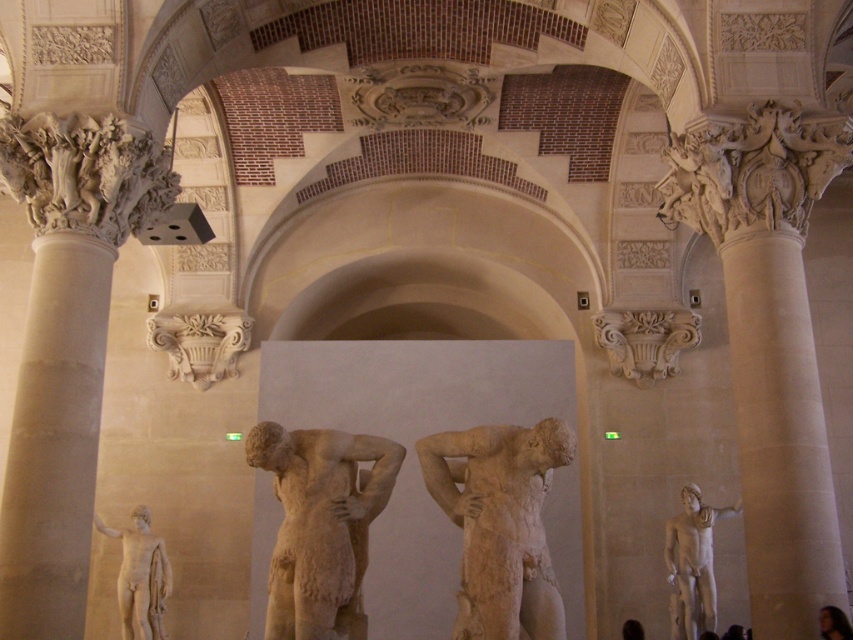
Question: Which of the following is the closest to the observer?

Choices:
 (A) (683, 628)
 (B) (741, 188)
 (C) (114, 259)

Answer: (B)

Question: Can you confirm if carved stone ornament at upper right is positioned to the left of blonde hair at lower right?

Choices:
 (A) yes
 (B) no

Answer: (B)

Question: Which of the following is the farthest from the observer?

Choices:
 (A) white marble statue at right
 (B) white marble column at left

Answer: (A)

Question: Can you confirm if white marble column at right is positioned to the left of matte white statue at lower left?

Choices:
 (A) no
 (B) yes

Answer: (A)

Question: Considering the real-world distances, which object is farthest from the smooth skin figure at center?

Choices:
 (A) matte white statue at lower left
 (B) beige stone statue at center

Answer: (B)

Question: Where is white marble column at right located in relation to carved stone ornament at upper right in the image?

Choices:
 (A) below
 (B) above

Answer: (A)